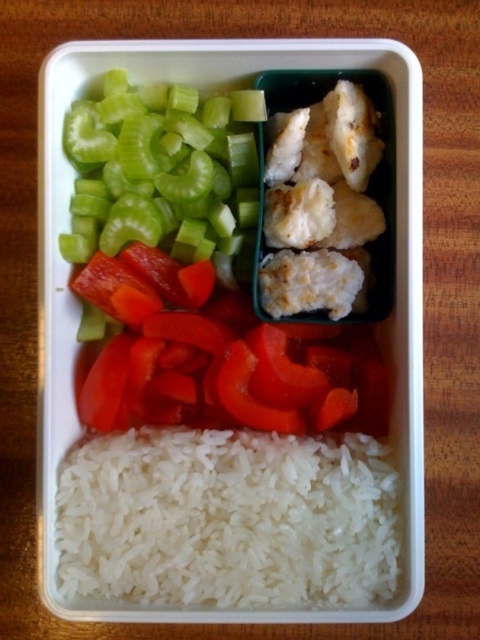
Question: Which of the following is the farthest from the observer?

Choices:
 (A) green crisp celery at upper left
 (B) white matte rice at bottom

Answer: (A)

Question: Which of the following is the farthest from the observer?

Choices:
 (A) (188, 570)
 (B) (166, 212)

Answer: (B)

Question: Can you confirm if white matte rice at bottom is bigger than green crisp celery at upper left?

Choices:
 (A) no
 (B) yes

Answer: (B)

Question: From the image, what is the correct spatial relationship of white matte rice at bottom in relation to green crisp celery at upper left?

Choices:
 (A) below
 (B) above

Answer: (A)

Question: Does white matte rice at bottom have a lesser width compared to green crisp celery at upper left?

Choices:
 (A) no
 (B) yes

Answer: (A)